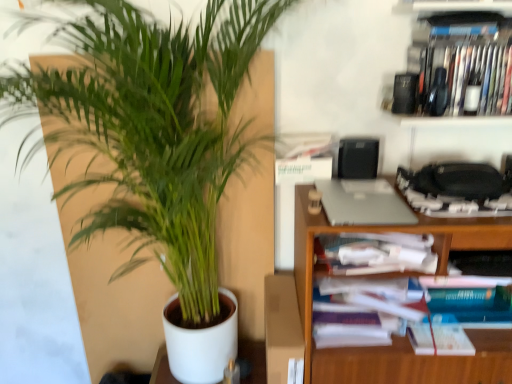
Question: Should I look upward or downward to see white paper book at center right?

Choices:
 (A) down
 (B) up

Answer: (A)

Question: Is black plastic speaker at upper right at the back of white paper book at center right?

Choices:
 (A) no
 (B) yes

Answer: (A)

Question: Does white paper book at center right have a greater width compared to black plastic speaker at upper right?

Choices:
 (A) no
 (B) yes

Answer: (B)

Question: Is the position of white paper book at center right less distant than that of black plastic speaker at upper right?

Choices:
 (A) no
 (B) yes

Answer: (B)

Question: Is white paper book at center right bigger than black plastic speaker at upper right?

Choices:
 (A) no
 (B) yes

Answer: (B)

Question: Can you confirm if white paper book at center right is thinner than black plastic speaker at upper right?

Choices:
 (A) no
 (B) yes

Answer: (A)

Question: From a real-world perspective, is white paper book at center right positioned under black plastic speaker at upper right based on gravity?

Choices:
 (A) no
 (B) yes

Answer: (B)

Question: Is green leafy plant at left positioned in front of white paper book at center right?

Choices:
 (A) yes
 (B) no

Answer: (B)

Question: Is green leafy plant at left outside of white paper book at center right?

Choices:
 (A) yes
 (B) no

Answer: (A)

Question: From the image's perspective, would you say green leafy plant at left is positioned over white paper book at center right?

Choices:
 (A) no
 (B) yes

Answer: (B)

Question: From the image's perspective, is green leafy plant at left beneath white paper book at center right?

Choices:
 (A) no
 (B) yes

Answer: (A)

Question: Is green leafy plant at left directly adjacent to white paper book at center right?

Choices:
 (A) yes
 (B) no

Answer: (B)

Question: Is green leafy plant at left thinner than white paper book at center right?

Choices:
 (A) no
 (B) yes

Answer: (B)

Question: Is white paper book at center right further to the viewer compared to silver metallic laptop at upper right?

Choices:
 (A) no
 (B) yes

Answer: (B)